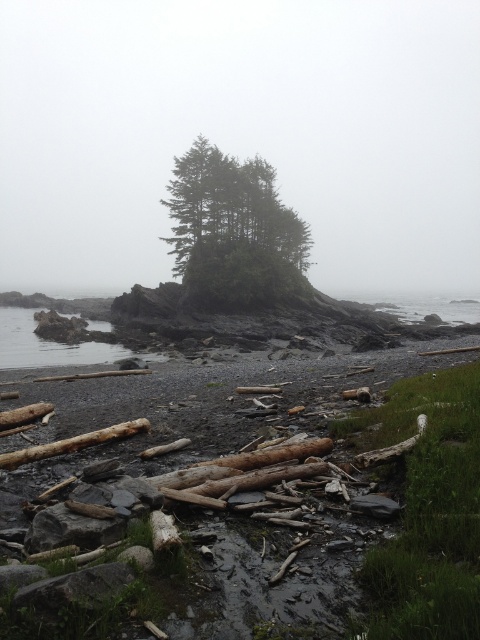
Question: From the image, what is the correct spatial relationship of green matte tree at center in relation to clear water at lower left?

Choices:
 (A) below
 (B) above

Answer: (B)

Question: Which object is the farthest from the green matte tree at center?

Choices:
 (A) dark brown driftwood at center
 (B) clear water at lower left
 (C) brown rough log at lower left

Answer: (C)

Question: Is dark brown driftwood at center below clear water at lower left?

Choices:
 (A) yes
 (B) no

Answer: (A)

Question: Among these objects, which one is nearest to the camera?

Choices:
 (A) dark brown driftwood at center
 (B) brown rough log at lower left

Answer: (A)

Question: Can you confirm if dark brown driftwood at center is positioned to the left of green matte tree at center?

Choices:
 (A) no
 (B) yes

Answer: (A)

Question: Estimate the real-world distances between objects in this image. Which object is farther from the brown rough log at lower left?

Choices:
 (A) dark brown driftwood at center
 (B) clear water at lower left
 (C) green matte tree at center

Answer: (C)